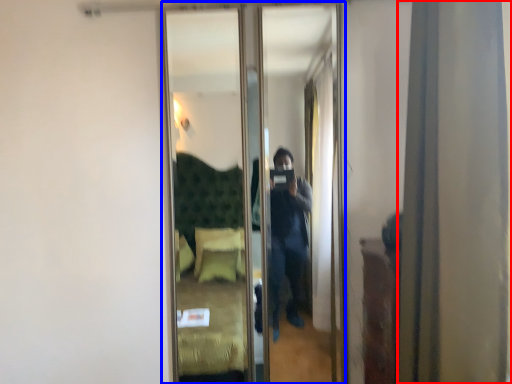
Question: Which object is further to the camera taking this photo, curtain (highlighted by a red box) or mirror (highlighted by a blue box)?

Choices:
 (A) curtain
 (B) mirror

Answer: (B)